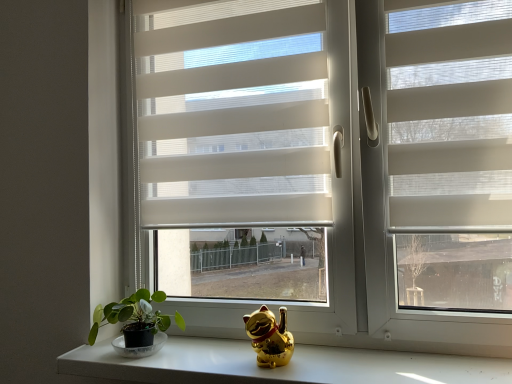
Question: Is green matte plant at lower left surrounded by white textured blinds at center?

Choices:
 (A) yes
 (B) no

Answer: (B)

Question: Is white textured blinds at center shorter than green matte plant at lower left?

Choices:
 (A) yes
 (B) no

Answer: (B)

Question: Does white textured blinds at center turn towards green matte plant at lower left?

Choices:
 (A) yes
 (B) no

Answer: (B)

Question: Can you confirm if white textured blinds at center is thinner than green matte plant at lower left?

Choices:
 (A) no
 (B) yes

Answer: (B)

Question: Can you confirm if white textured blinds at center is positioned to the left of green matte plant at lower left?

Choices:
 (A) yes
 (B) no

Answer: (B)

Question: Considering the relative sizes of white textured blinds at center and green matte plant at lower left in the image provided, is white textured blinds at center smaller than green matte plant at lower left?

Choices:
 (A) yes
 (B) no

Answer: (B)

Question: Considering the relative sizes of gold shiny cat at center and white matte window at center in the image provided, is gold shiny cat at center thinner than white matte window at center?

Choices:
 (A) no
 (B) yes

Answer: (B)

Question: Is gold shiny cat at center positioned in front of white matte window at center?

Choices:
 (A) yes
 (B) no

Answer: (B)

Question: Considering the relative sizes of gold shiny cat at center and white matte window at center in the image provided, is gold shiny cat at center smaller than white matte window at center?

Choices:
 (A) no
 (B) yes

Answer: (B)

Question: Does gold shiny cat at center appear on the left side of white matte window at center?

Choices:
 (A) no
 (B) yes

Answer: (B)

Question: From the image's perspective, does gold shiny cat at center appear lower than white matte window at center?

Choices:
 (A) no
 (B) yes

Answer: (B)

Question: Is gold shiny cat at center positioned with its back to white matte window at center?

Choices:
 (A) no
 (B) yes

Answer: (B)

Question: Are gold metallic cat figurine at lower center and gold shiny cat at center beside each other?

Choices:
 (A) no
 (B) yes

Answer: (A)